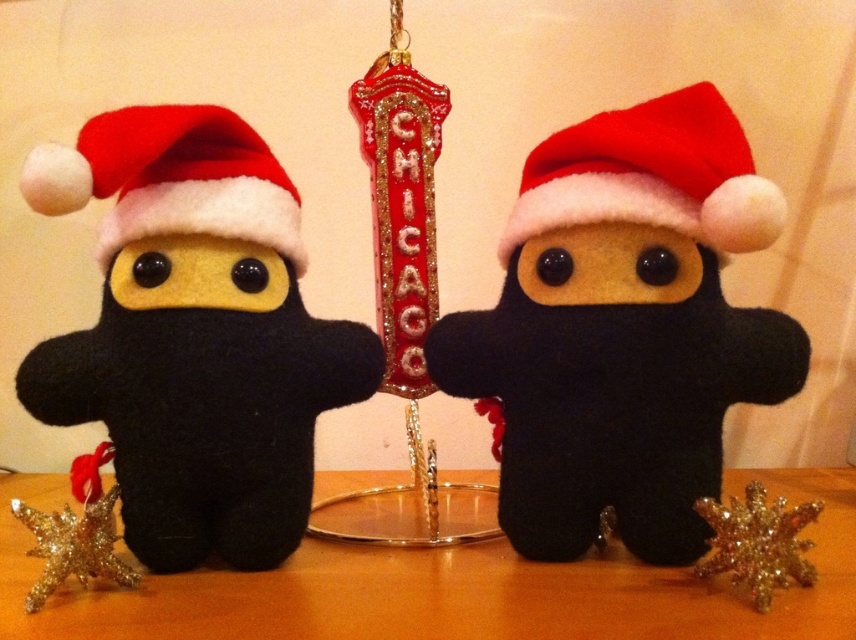
You are organizing a holiday display and need to ensure that the matte black ninja at center and the wooden table at center fit within a 2x2 meter space. Based on their sizes, will they both fit comfortably?

The matte black ninja at center occupies less space than the wooden table at center. Since the total space required by both objects is less than the 2x2 meter area, they should fit comfortably within the allocated space.

Which of the two stars, the gold glitter star at lower right or the shiny metallic star at lower left, is bigger in size?

The gold glitter star at lower right is larger in size than the shiny metallic star at lower left.